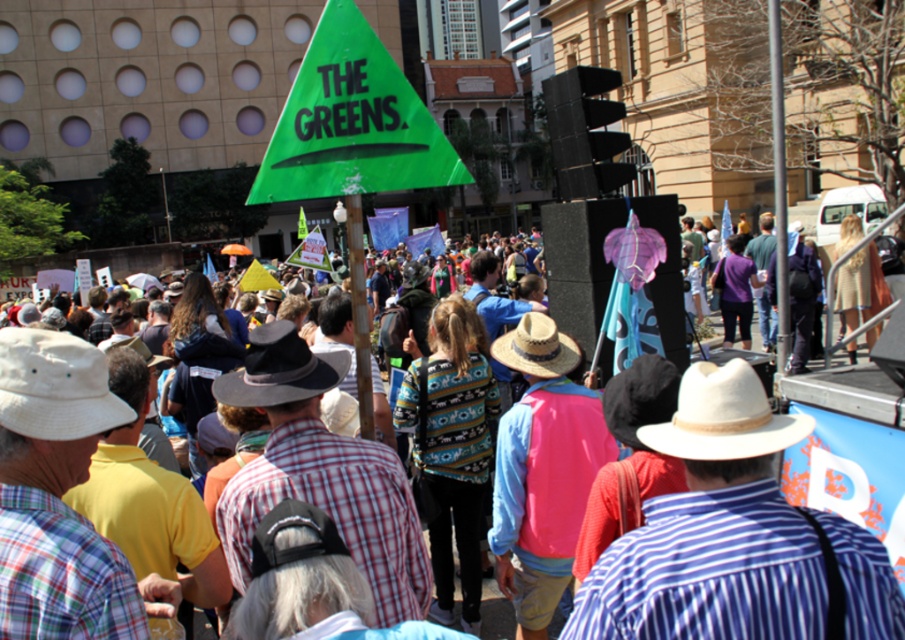
Question: Does white fabric cowboy hat at left have a lesser width compared to dark brown felt cowboy hat at center?

Choices:
 (A) no
 (B) yes

Answer: (B)

Question: Does white straw cowboy hat at center have a larger size compared to strawhat at center?

Choices:
 (A) no
 (B) yes

Answer: (A)

Question: Is dark brown felt cowboy hat at center smaller than strawhat at center?

Choices:
 (A) no
 (B) yes

Answer: (A)

Question: Which object is positioned closest to the white straw cowboy hat at center?

Choices:
 (A) white fabric cowboy hat at left
 (B) strawhat at center
 (C) dark brown felt cowboy hat at center

Answer: (B)

Question: Which point is farther from the camera taking this photo?

Choices:
 (A) 678,413
 (B) 7,346
 (C) 553,340
 (D) 343,368

Answer: (C)

Question: Which object is the farthest from the dark brown felt cowboy hat at center?

Choices:
 (A) white straw cowboy hat at center
 (B) white fabric cowboy hat at left
 (C) strawhat at center

Answer: (A)